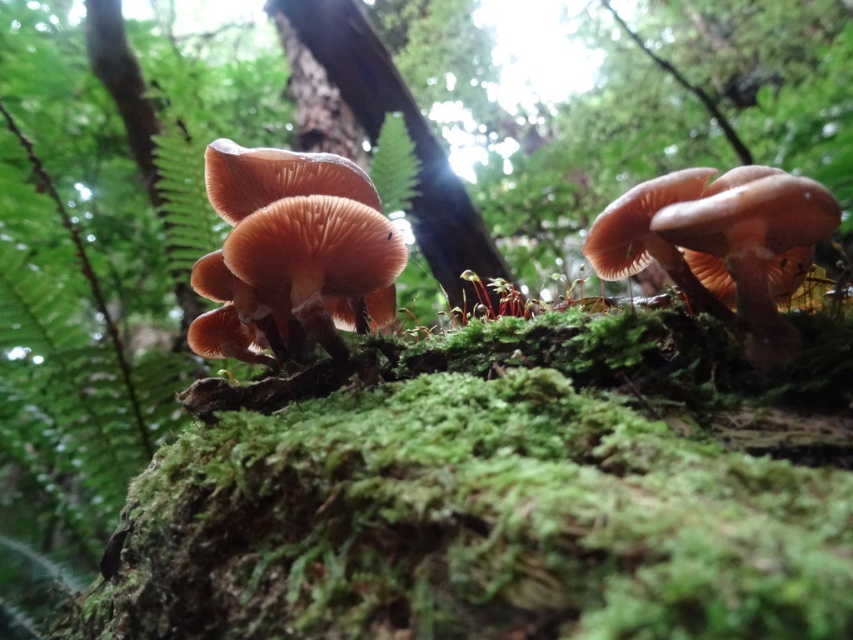
You are a photographer standing in the forest scene described. You want to capture a closeup of the brown matte fungi at center. Based on their position, where should you aim your camera to ensure they are centered in your shot?

You should aim your camera at the coordinates point (292, 252) to center the brown matte fungi at center in your shot.

You are a hiker who wants to take a photo of the brown matte fungi at center and the smooth brown tree trunk at center. Which object should you adjust your camera to focus on first if you want to capture both in the same frame?

The brown matte fungi at center is to the right of the smooth brown tree trunk at center, so you should focus on the smooth brown tree trunk at center first since it is closer to the camera.

You are a photographer adjusting your camera to focus on two points in a forest scene. The first point is at coordinates point (x=291, y=257) and the second is at point (x=438, y=209). Which point should you focus on first if you want to capture the closest object to the camera?

You should focus on point (x=291, y=257) first because it is closer to the camera than point (x=438, y=209).